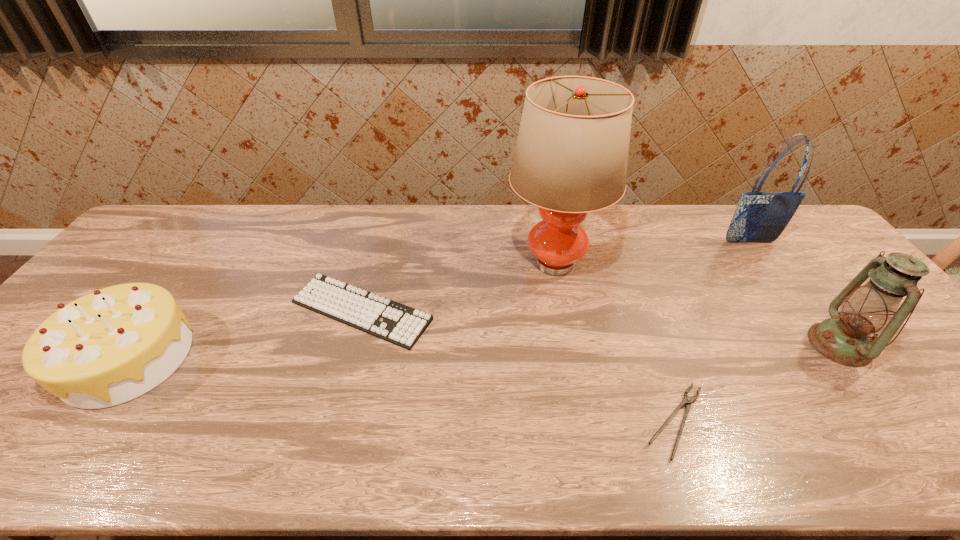
You are a GUI agent. You are given a task and a screenshot of the screen. Output one action in this format:
    pyautogui.click(x=<x>, y=<y>)
    Task: Click on the tallest object
    The width and height of the screenshot is (960, 540).
    Given the screenshot: What is the action you would take?
    pyautogui.click(x=571, y=155)

Where is `the second tallest object`? The width and height of the screenshot is (960, 540). the second tallest object is located at coordinates (759, 217).

The height and width of the screenshot is (540, 960). In order to click on oil lamp in this screenshot , I will do `click(845, 338)`.

The image size is (960, 540). In order to click on birthday cake in this screenshot , I will do `click(115, 344)`.

Identify the location of the third shortest object. (115, 344).

The image size is (960, 540). In order to click on the fifth tallest object in this screenshot , I will do (391, 321).

Identify the location of computer keyboard. The image size is (960, 540). (391, 321).

Where is `tongs`? tongs is located at coordinates (687, 400).

The width and height of the screenshot is (960, 540). In order to click on blank space located on the back of the lamp in this screenshot , I will do `click(544, 208)`.

Identify the location of vacant space located 0.070m on the front-facing side of the fifth shortest object. (762, 260).